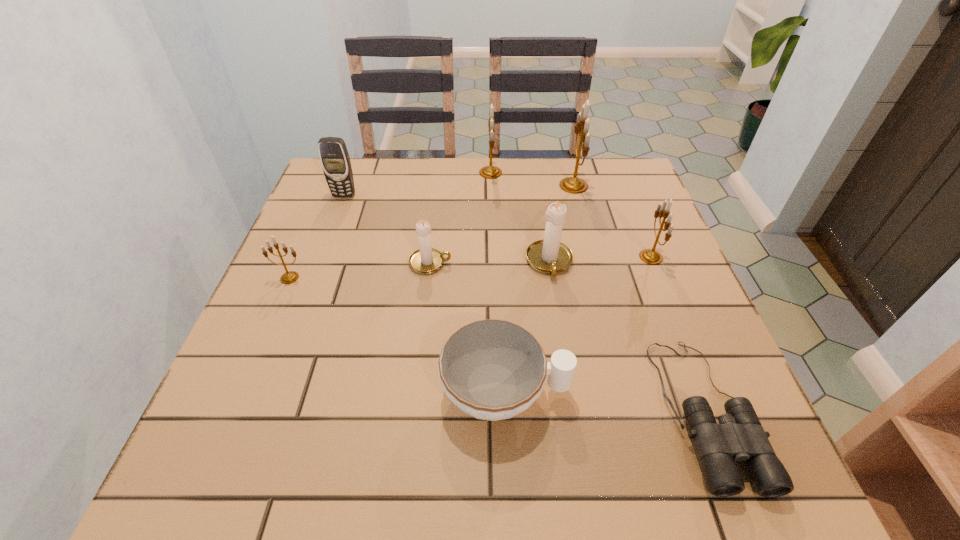
The height and width of the screenshot is (540, 960). In order to click on the nearest gold candelabrum in this screenshot , I will do `click(289, 277)`.

You are a GUI agent. You are given a task and a screenshot of the screen. Output one action in this format:
    pyautogui.click(x=<x>, y=<y>)
    Task: Click on the fifth candle holder from right to left
    
    Given the screenshot: What is the action you would take?
    pyautogui.click(x=425, y=260)

Find the location of a particular element. The width and height of the screenshot is (960, 540). the smaller white candle holder is located at coordinates (425, 260).

Where is `chinaware`? Image resolution: width=960 pixels, height=540 pixels. chinaware is located at coordinates (491, 369).

Image resolution: width=960 pixels, height=540 pixels. I want to click on the second shortest object, so click(491, 369).

Find the location of a particular element. This screenshot has width=960, height=540. binoculars is located at coordinates (739, 435).

Find the location of a particular element. vacant point located on the front of the third gold candelabrum from left to right is located at coordinates (596, 272).

Where is `free point located 0.390m on the front of the second tallest candle holder`? The height and width of the screenshot is (540, 960). free point located 0.390m on the front of the second tallest candle holder is located at coordinates (494, 280).

Where is `free space located 0.250m on the front face of the cellular telephone`? The height and width of the screenshot is (540, 960). free space located 0.250m on the front face of the cellular telephone is located at coordinates (320, 261).

Where is `free region located on the handle side of the fourth candle holder from left to right`? This screenshot has width=960, height=540. free region located on the handle side of the fourth candle holder from left to right is located at coordinates (561, 332).